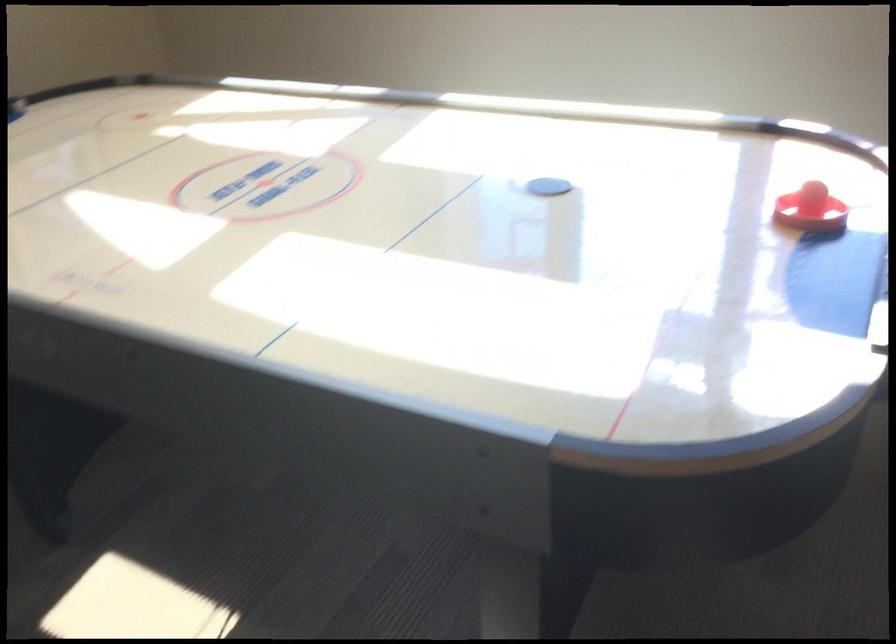
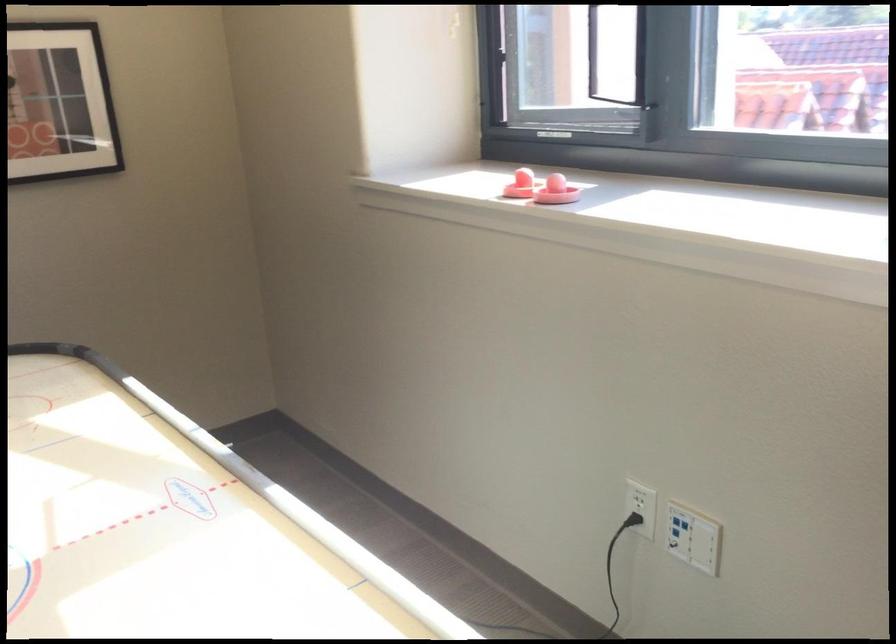
Question: The images are taken continuously from a first-person perspective. In which direction is your viewpoint rotating?

Choices:
 (A) Left
 (B) Right
 (C) Up
 (D) Down

Answer: (A)